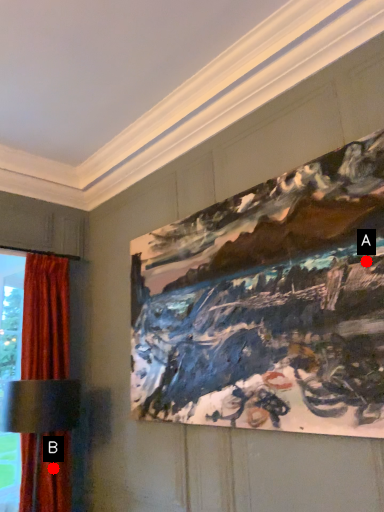
Question: Two points are circled on the image, labeled by A and B beside each circle. Which point is closer to the camera taking this photo?

Choices:
 (A) A is closer
 (B) B is closer

Answer: (A)